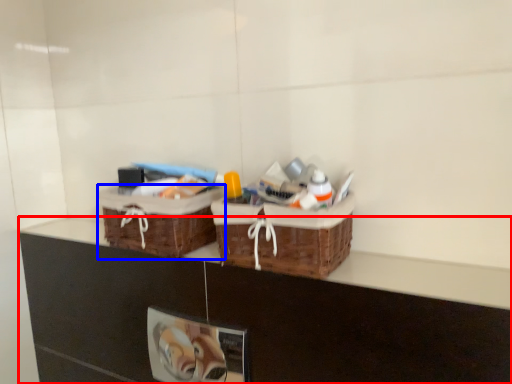
Question: Which of the following is the farthest to the observer, counter (highlighted by a red box) or picnic basket (highlighted by a blue box)?

Choices:
 (A) counter
 (B) picnic basket

Answer: (B)